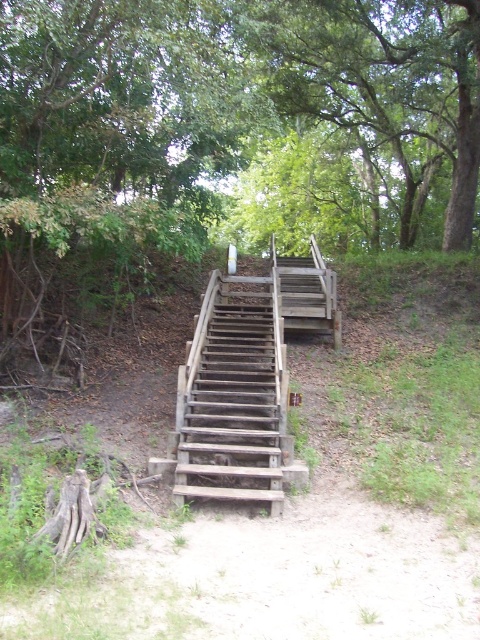
Question: Considering the relative positions of green leafy tree at center and green leafy tree at upper center in the image provided, where is green leafy tree at center located with respect to green leafy tree at upper center?

Choices:
 (A) right
 (B) left

Answer: (B)

Question: Observing the image, what is the correct spatial positioning of green leafy tree at center in reference to weathered wood stairs at center?

Choices:
 (A) below
 (B) above

Answer: (B)

Question: Which is nearer to the weathered wood stairs at center?

Choices:
 (A) green leafy tree at upper center
 (B) green leafy tree at center

Answer: (B)

Question: Among these objects, which one is farthest from the camera?

Choices:
 (A) green leafy tree at center
 (B) weathered wood stairs at center
 (C) green leafy tree at upper center

Answer: (C)

Question: Where is green leafy tree at center located in relation to weathered wood stairs at center in the image?

Choices:
 (A) above
 (B) below

Answer: (A)

Question: Among these points, which one is nearest to the camera?

Choices:
 (A) (448, 224)
 (B) (220, 401)
 (C) (251, 4)

Answer: (B)